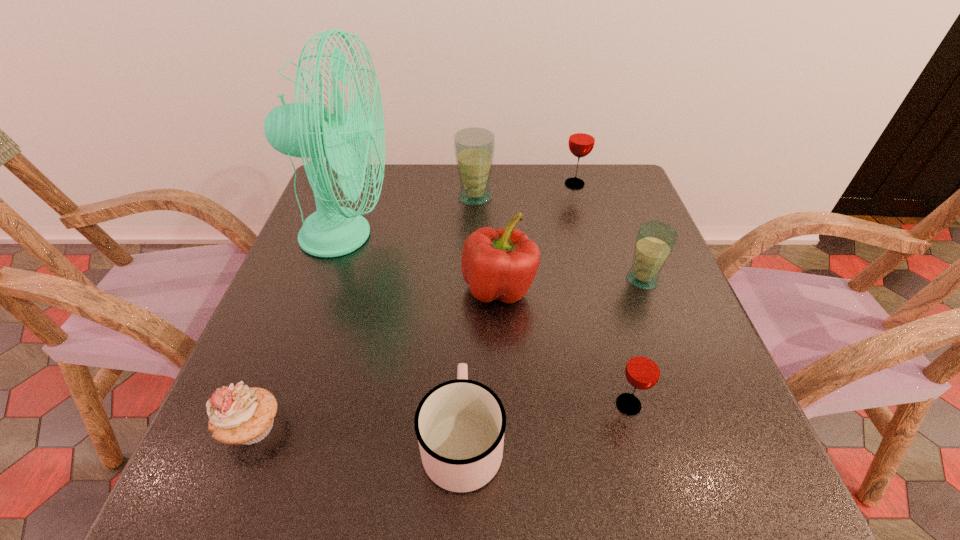
Identify the location of vacant area in the image that satisfies the following two spatial constraints: 1. in front of the blue fan to blow air; 2. on the right side of the smaller red glass. This screenshot has width=960, height=540. (287, 404).

This screenshot has height=540, width=960. In order to click on blank space that satisfies the following two spatial constraints: 1. on the front side of the pink bell pepper; 2. on the left side of the nearest glass in this screenshot , I will do pyautogui.click(x=504, y=404).

Image resolution: width=960 pixels, height=540 pixels. Find the location of `free space that satisfies the following two spatial constraints: 1. on the side of the farther red glass with the handle; 2. on the left side of the mug`. free space that satisfies the following two spatial constraints: 1. on the side of the farther red glass with the handle; 2. on the left side of the mug is located at coordinates (470, 184).

The image size is (960, 540). In order to click on free point that satisfies the following two spatial constraints: 1. in front of the bell pepper to blow air; 2. on the right side of the blue fan in this screenshot , I will do `click(327, 288)`.

The height and width of the screenshot is (540, 960). Identify the location of vacant space that satisfies the following two spatial constraints: 1. on the front side of the nearer red glass; 2. on the left side of the farther blue glass. (471, 404).

Find the location of a particular element. The width and height of the screenshot is (960, 540). vacant space that satisfies the following two spatial constraints: 1. on the back side of the cupcake; 2. on the left side of the bell pepper is located at coordinates (307, 288).

This screenshot has height=540, width=960. I want to click on free space that satisfies the following two spatial constraints: 1. on the side of the mug with the handle; 2. in front of the tallest object to blow air, so click(x=468, y=235).